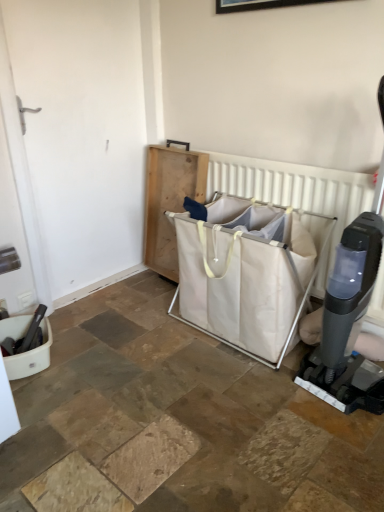
Question: Would you say white fabric laundry basket at center is part of white fabric laundry basket at center's contents?

Choices:
 (A) no
 (B) yes

Answer: (B)

Question: From the image's perspective, would you say white fabric laundry basket at center is shown under white fabric laundry basket at center?

Choices:
 (A) yes
 (B) no

Answer: (A)

Question: Considering the relative sizes of white fabric laundry basket at center and white fabric laundry basket at center in the image provided, is white fabric laundry basket at center shorter than white fabric laundry basket at center?

Choices:
 (A) yes
 (B) no

Answer: (A)

Question: From a real-world perspective, is white fabric laundry basket at center beneath white fabric laundry basket at center?

Choices:
 (A) yes
 (B) no

Answer: (A)

Question: Is white fabric laundry basket at center bigger than white fabric laundry basket at center?

Choices:
 (A) no
 (B) yes

Answer: (B)

Question: Is white fabric laundry basket at center oriented away from white fabric laundry basket at center?

Choices:
 (A) yes
 (B) no

Answer: (A)

Question: Considering the relative positions of white fabric laundry basket at center and light brown wooden tray at center in the image provided, is white fabric laundry basket at center to the right of light brown wooden tray at center from the viewer's perspective?

Choices:
 (A) yes
 (B) no

Answer: (A)

Question: Is white fabric laundry basket at center to the left of light brown wooden tray at center from the viewer's perspective?

Choices:
 (A) no
 (B) yes

Answer: (A)

Question: Is white fabric laundry basket at center next to light brown wooden tray at center and touching it?

Choices:
 (A) yes
 (B) no

Answer: (B)

Question: Does white fabric laundry basket at center have a smaller size compared to light brown wooden tray at center?

Choices:
 (A) no
 (B) yes

Answer: (A)

Question: From a real-world perspective, is white fabric laundry basket at center on light brown wooden tray at center?

Choices:
 (A) yes
 (B) no

Answer: (B)

Question: Is white fabric laundry basket at center behind light brown wooden tray at center?

Choices:
 (A) no
 (B) yes

Answer: (A)

Question: Can we say white fabric laundry basket at center lies outside white fabric laundry basket at center?

Choices:
 (A) yes
 (B) no

Answer: (B)